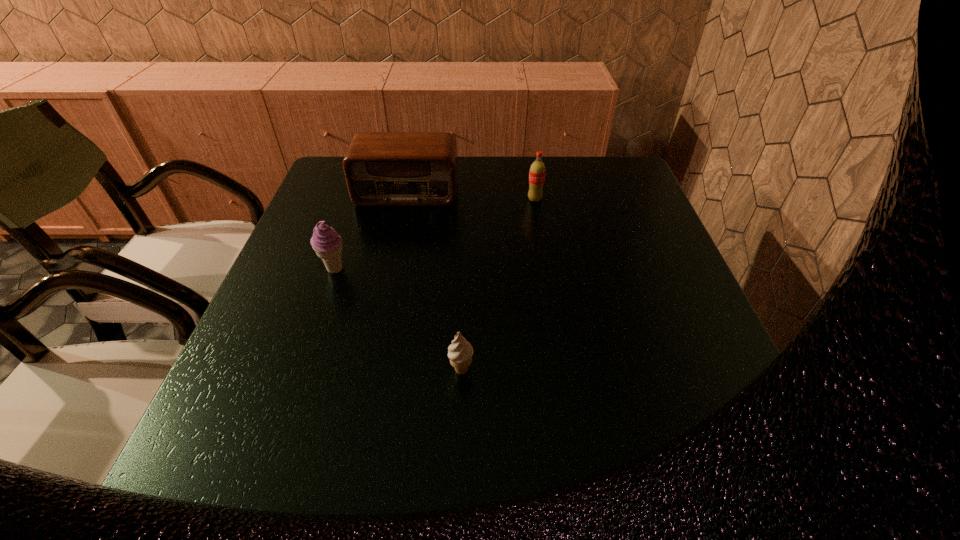
This screenshot has width=960, height=540. I want to click on radio receiver, so click(381, 168).

You are a GUI agent. You are given a task and a screenshot of the screen. Output one action in this format:
    pyautogui.click(x=<x>, y=<y>)
    Task: Click on the rightmost object
    This screenshot has width=960, height=540.
    Given the screenshot: What is the action you would take?
    pyautogui.click(x=537, y=171)

Locate an element on the screen. The image size is (960, 540). the farther icecream is located at coordinates (326, 242).

The width and height of the screenshot is (960, 540). Identify the location of the second nearest object. (326, 242).

The image size is (960, 540). I want to click on the shortest object, so [x=460, y=352].

You are a GUI agent. You are given a task and a screenshot of the screen. Output one action in this format:
    pyautogui.click(x=<x>, y=<y>)
    Task: Click on the shorter icecream
    This screenshot has height=540, width=960.
    Given the screenshot: What is the action you would take?
    pyautogui.click(x=460, y=352)

Locate an element on the screen. Image resolution: width=960 pixels, height=540 pixels. vacant space located on the front panel of the radio receiver is located at coordinates (380, 319).

Where is `vacant space located 0.250m on the front of the rightmost object`? The width and height of the screenshot is (960, 540). vacant space located 0.250m on the front of the rightmost object is located at coordinates point(545,265).

I want to click on free point located 0.210m on the front of the taller icecream, so click(305, 356).

Locate an element on the screen. The height and width of the screenshot is (540, 960). free space located on the front-facing side of the right icecream is located at coordinates (461, 406).